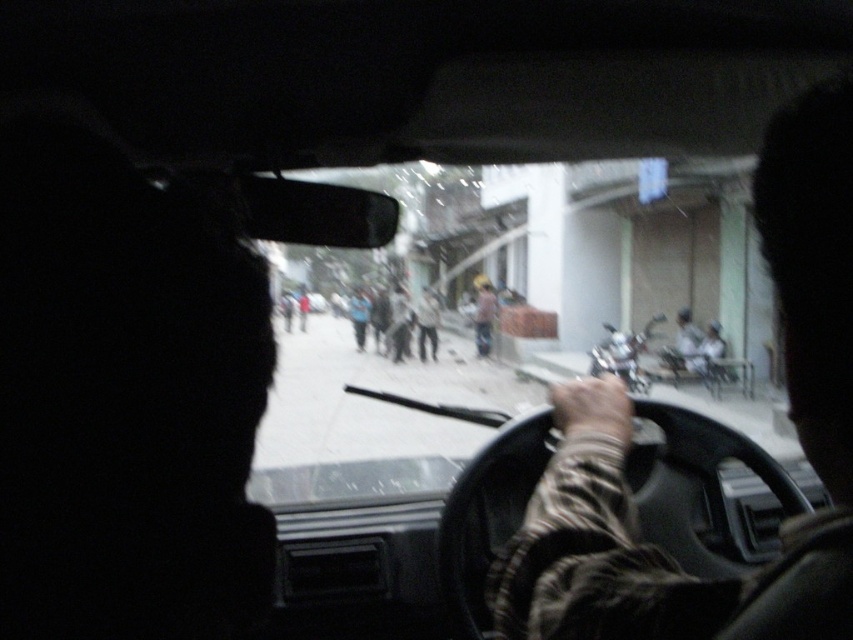
Question: Estimate the real-world distances between objects in this image. Which object is closer to the camouflage fabric sleeve at center?

Choices:
 (A) blue fabric person at center
 (B) light brown fabric shirt at center
 (C) transparent glass windshield at center

Answer: (C)

Question: In this image, where is camouflage fabric sleeve at center located relative to light brown fabric shirt at center?

Choices:
 (A) below
 (B) above

Answer: (A)

Question: Which point is farther to the camera?

Choices:
 (A) (683, 368)
 (B) (656, 321)
 (C) (363, 310)
 (D) (431, 291)

Answer: (D)

Question: Is smooth gray helmet at center thinner than blue fabric person at center?

Choices:
 (A) no
 (B) yes

Answer: (B)

Question: Which is farther from the smooth gray helmet at center?

Choices:
 (A) light brown fabric shirt at center
 (B) yellow helmet at center
 (C) camouflage fabric sleeve at center
 (D) transparent glass windshield at center

Answer: (C)

Question: Is yellow helmet at center wider than light brown fabric shirt at center?

Choices:
 (A) no
 (B) yes

Answer: (A)